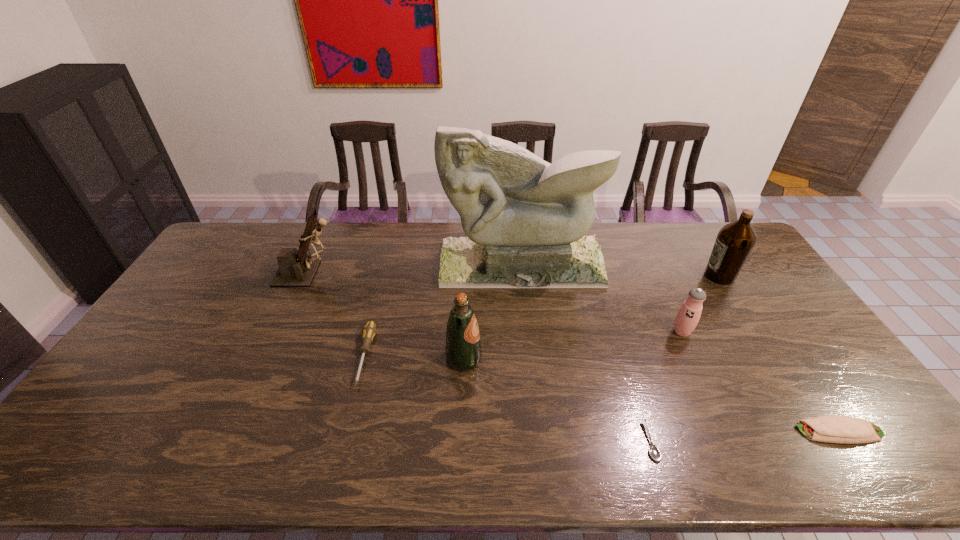
The width and height of the screenshot is (960, 540). I want to click on vacant region located on the base of the tallest object, so click(532, 368).

Where is `vacant position located on the front-facing side of the leftmost object`? vacant position located on the front-facing side of the leftmost object is located at coordinates (397, 274).

You are a GUI agent. You are given a task and a screenshot of the screen. Output one action in this format:
    pyautogui.click(x=<x>, y=<y>)
    Task: Click on the free region located on the label of the farther olive oil
    
    Given the screenshot: What is the action you would take?
    pyautogui.click(x=596, y=276)

The image size is (960, 540). Identify the location of vacant area located 0.310m on the label of the farther olive oil. (613, 276).

Locate an element on the screen. The width and height of the screenshot is (960, 540). free region located on the label of the farther olive oil is located at coordinates (678, 276).

Find the location of a particular element. free region located 0.160m on the front-facing side of the left olive oil is located at coordinates (x=539, y=359).

You are a GUI agent. You are given a task and a screenshot of the screen. Output one action in this format:
    pyautogui.click(x=<x>, y=<y>)
    Task: Click on the free space located on the right of the third object from right to left
    The height and width of the screenshot is (540, 960).
    Given the screenshot: What is the action you would take?
    pyautogui.click(x=792, y=332)

Find the location of a particular element. The image size is (960, 540). free spot located at the tip of the third shortest object is located at coordinates (344, 442).

You are a GUI agent. You are given a task and a screenshot of the screen. Output one action in this format:
    pyautogui.click(x=<x>, y=<y>)
    Task: Click on the free spot located 0.130m at the bitten end of the seventh tallest object
    This screenshot has height=540, width=960.
    Given the screenshot: What is the action you would take?
    pyautogui.click(x=744, y=431)

Image resolution: width=960 pixels, height=540 pixels. I want to click on vacant space located 0.340m at the bitten end of the seventh tallest object, so click(659, 431).